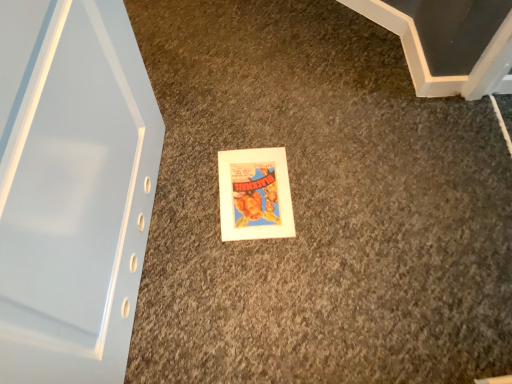
Identify the location of white glossy door at left. (72, 188).

The height and width of the screenshot is (384, 512). Describe the element at coordinates (72, 188) in the screenshot. I see `white glossy door at left` at that location.

What is the approximate height of white glossy door at left?

white glossy door at left is 80.42 centimeters in height.

This screenshot has height=384, width=512. In order to click on white glossy door at left in this screenshot , I will do `click(72, 188)`.